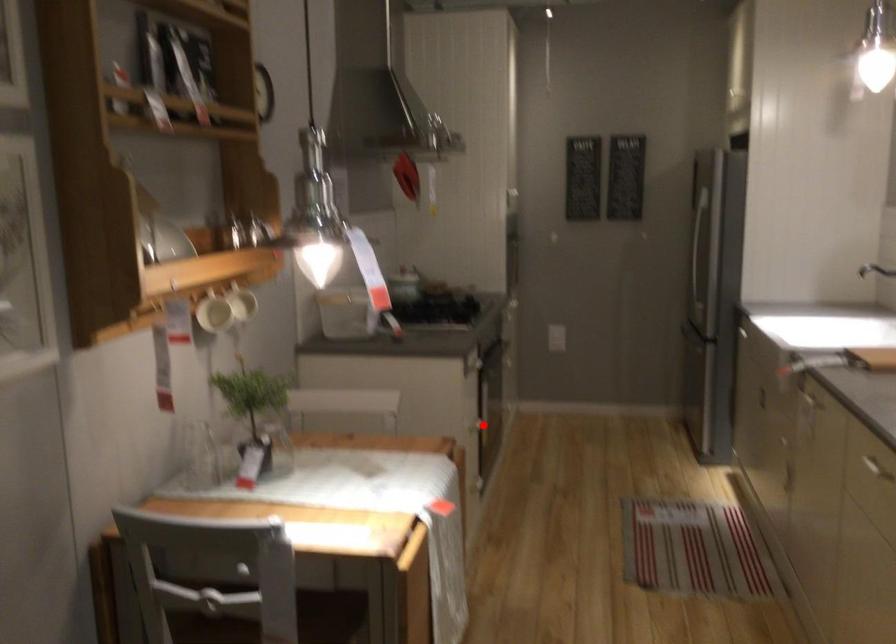
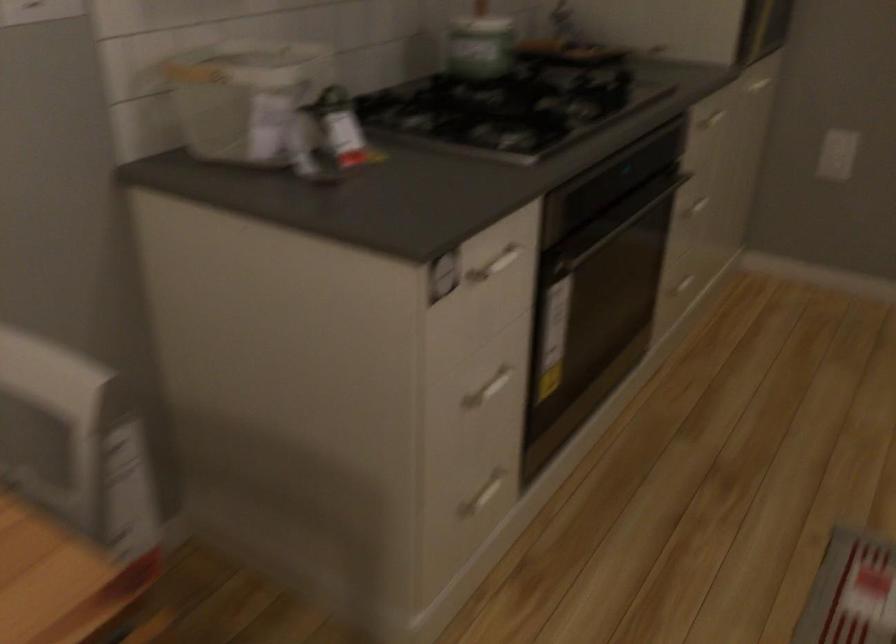
The point at the highlighted location is marked in the first image. Where is the corresponding point in the second image?

(487, 389)